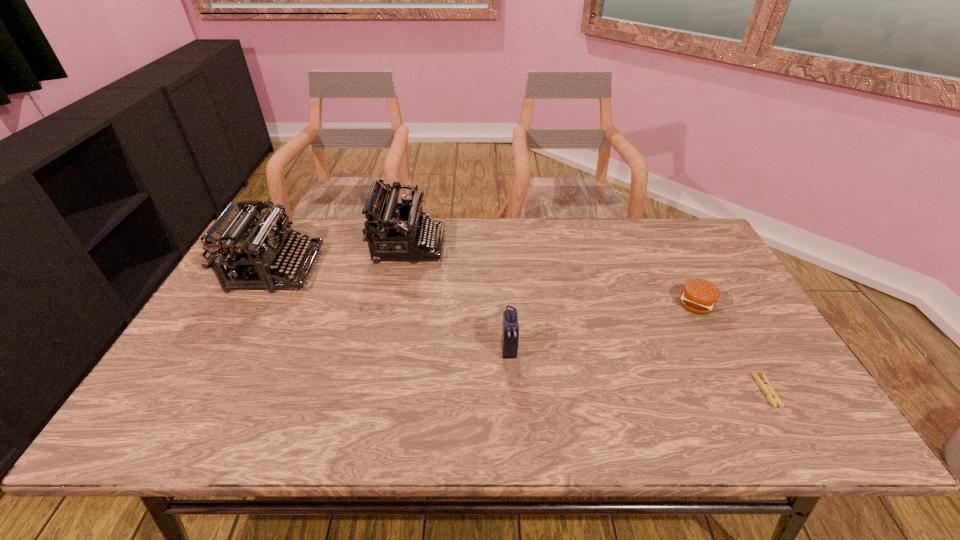
Image resolution: width=960 pixels, height=540 pixels. Identify the location of free space in the image that satisfies the following two spatial constraints: 1. with the zip open on the second nearest object; 2. on the left side of the shortest object. (512, 391).

This screenshot has height=540, width=960. I want to click on free location that satisfies the following two spatial constraints: 1. on the back side of the hamburger; 2. on the typing side of the leftmost object, so click(677, 268).

You are a GUI agent. You are given a task and a screenshot of the screen. Output one action in this format:
    pyautogui.click(x=<x>, y=<y>)
    Task: Click on the vacant space that satisfies the following two spatial constraints: 1. on the typing side of the left typewriter; 2. on the back side of the nearest object
    
    Given the screenshot: What is the action you would take?
    pyautogui.click(x=209, y=391)